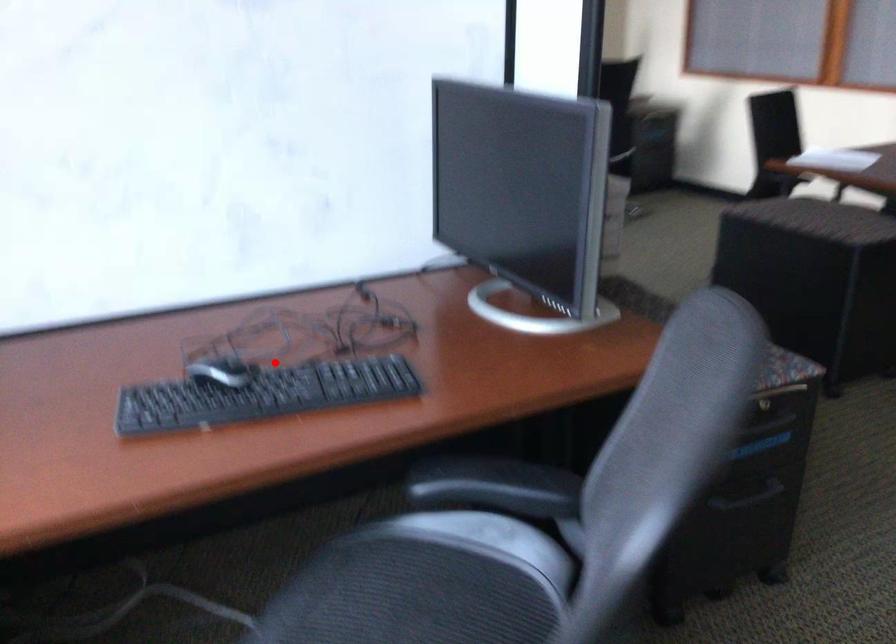
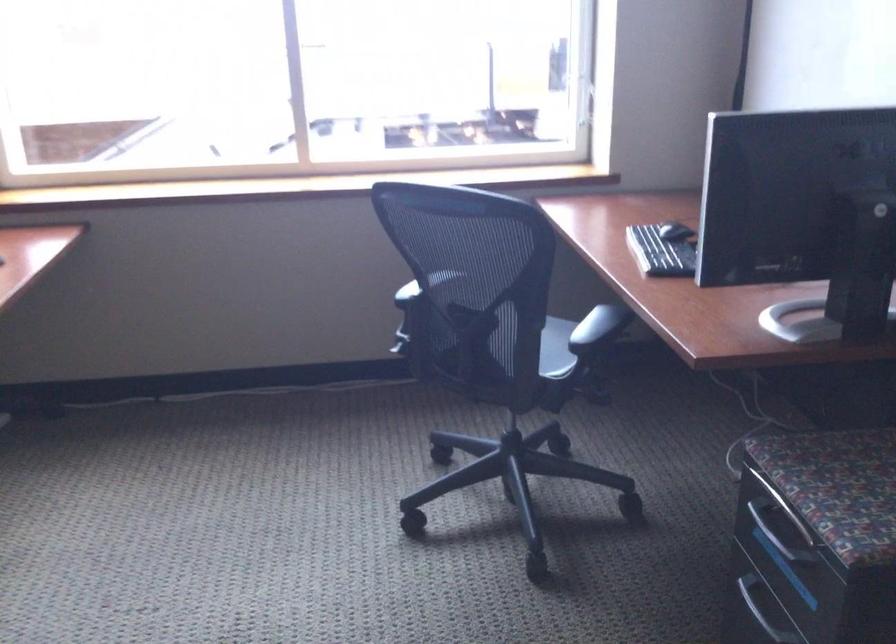
Question: A red point is marked in image1. In image2, is the corresponding 3D point closer to the camera or farther? Reply with the corresponding letter.

Choices:
 (A) The corresponding 3D point is closer.
 (B) The corresponding 3D point is farther.

Answer: (B)